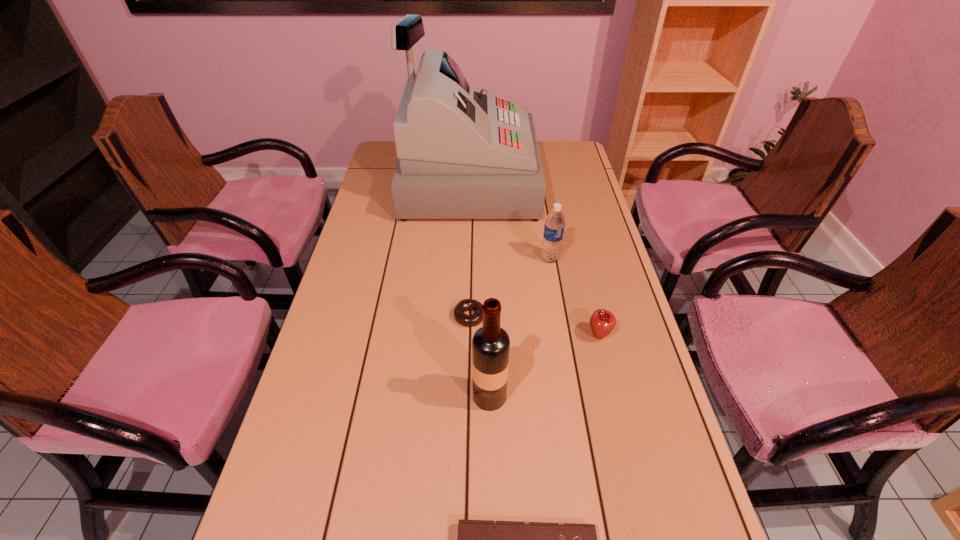
The width and height of the screenshot is (960, 540). I want to click on free point located 0.390m on the left of the fifth farthest object, so [304, 396].

Locate an element on the screen. The image size is (960, 540). vacant space located on the front of the water bottle is located at coordinates (570, 377).

This screenshot has height=540, width=960. What are the coordinates of `vacant area situated 0.060m on the front of the rightmost object` in the screenshot? It's located at (607, 364).

Where is `vacant space located on the right of the doughnut`? The width and height of the screenshot is (960, 540). vacant space located on the right of the doughnut is located at coordinates (570, 316).

Where is `object at the far edge`? object at the far edge is located at coordinates (462, 154).

I want to click on object that is at the left edge, so click(462, 154).

Locate an element on the screen. object positioned at the right edge is located at coordinates (602, 322).

You are a GUI agent. You are given a task and a screenshot of the screen. Output one action in this format:
    pyautogui.click(x=<x>, y=<y>)
    Task: Click on the object situated at the far left corner
    The height and width of the screenshot is (540, 960).
    Given the screenshot: What is the action you would take?
    pyautogui.click(x=462, y=154)

Where is `free location at the left edge of the desktop`? Image resolution: width=960 pixels, height=540 pixels. free location at the left edge of the desktop is located at coordinates (311, 409).

Where is `free space at the right edge of the desktop`? The height and width of the screenshot is (540, 960). free space at the right edge of the desktop is located at coordinates (588, 185).